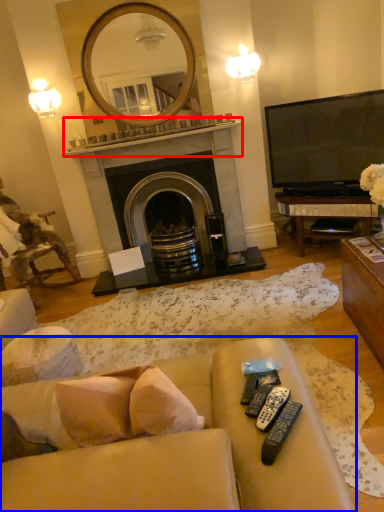
Question: Which of the following is the farthest to the observer, mantle (highlighted by a red box) or studio couch (highlighted by a blue box)?

Choices:
 (A) mantle
 (B) studio couch

Answer: (A)